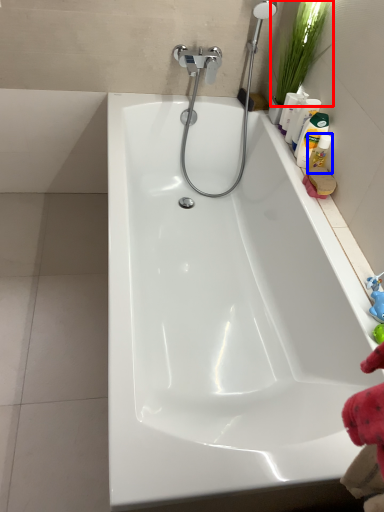
Question: Which point is closer to the camera, plant (highlighted by a red box) or cleaning product (highlighted by a blue box)?

Choices:
 (A) plant
 (B) cleaning product

Answer: (A)